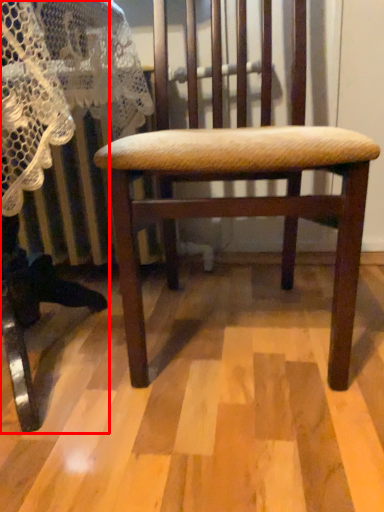
Question: From the image's perspective, what is the correct spatial relationship of rocking chair (annotated by the red box) in relation to chair?

Choices:
 (A) above
 (B) below

Answer: (B)